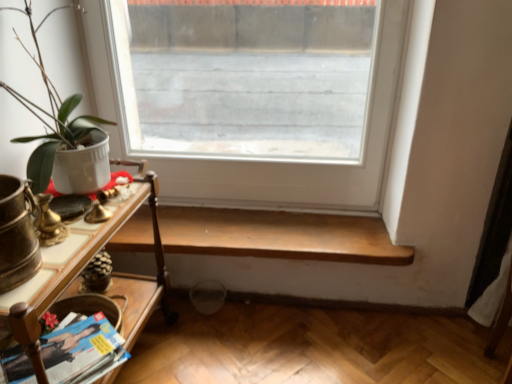
Question: Considering the relative positions of matte paper magazine at lower left and clear glass window at center in the image provided, is matte paper magazine at lower left to the left of clear glass window at center from the viewer's perspective?

Choices:
 (A) no
 (B) yes

Answer: (B)

Question: Could you tell me if matte paper magazine at lower left is turned towards clear glass window at center?

Choices:
 (A) yes
 (B) no

Answer: (B)

Question: Can you confirm if matte paper magazine at lower left is bigger than clear glass window at center?

Choices:
 (A) no
 (B) yes

Answer: (A)

Question: From the image's perspective, is matte paper magazine at lower left above clear glass window at center?

Choices:
 (A) no
 (B) yes

Answer: (A)

Question: Is matte paper magazine at lower left wider than clear glass window at center?

Choices:
 (A) yes
 (B) no

Answer: (A)

Question: Can you confirm if matte paper magazine at lower left is positioned to the right of clear glass window at center?

Choices:
 (A) yes
 (B) no

Answer: (B)

Question: Considering the relative positions of wooden shelf at lower center and wooden table at left in the image provided, is wooden shelf at lower center to the right of wooden table at left from the viewer's perspective?

Choices:
 (A) yes
 (B) no

Answer: (A)

Question: Is wooden shelf at lower center surrounding wooden table at left?

Choices:
 (A) no
 (B) yes

Answer: (A)

Question: Could you tell me if wooden shelf at lower center is facing wooden table at left?

Choices:
 (A) yes
 (B) no

Answer: (A)

Question: Is wooden shelf at lower center far away from wooden table at left?

Choices:
 (A) no
 (B) yes

Answer: (A)

Question: Does wooden shelf at lower center have a smaller size compared to wooden table at left?

Choices:
 (A) yes
 (B) no

Answer: (A)

Question: From a real-world perspective, is wooden shelf at lower center beneath wooden table at left?

Choices:
 (A) yes
 (B) no

Answer: (A)

Question: From the image's perspective, is matte paper magazine at lower left on top of wooden table at left?

Choices:
 (A) no
 (B) yes

Answer: (A)